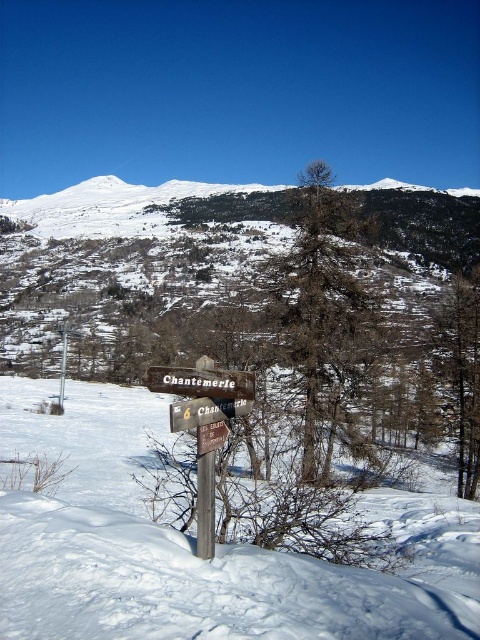
Question: Does wooden sign at center have a smaller size compared to brown wooden sign at center?

Choices:
 (A) yes
 (B) no

Answer: (A)

Question: Considering the relative positions of wooden sign at center and brown wooden sign at center in the image provided, where is wooden sign at center located with respect to brown wooden sign at center?

Choices:
 (A) left
 (B) right

Answer: (B)

Question: Among these objects, which one is nearest to the camera?

Choices:
 (A) brown wooden sign at center
 (B) wooden sign at center

Answer: (A)

Question: Is wooden sign at center wider than brown wooden sign at center?

Choices:
 (A) yes
 (B) no

Answer: (B)

Question: Which point is closer to the camera?

Choices:
 (A) (206, 413)
 (B) (253, 394)

Answer: (B)